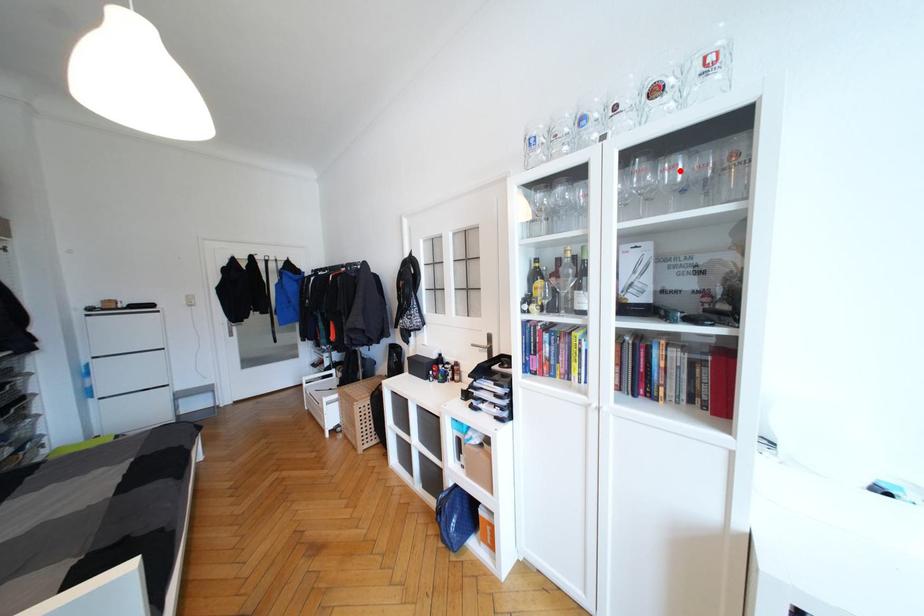
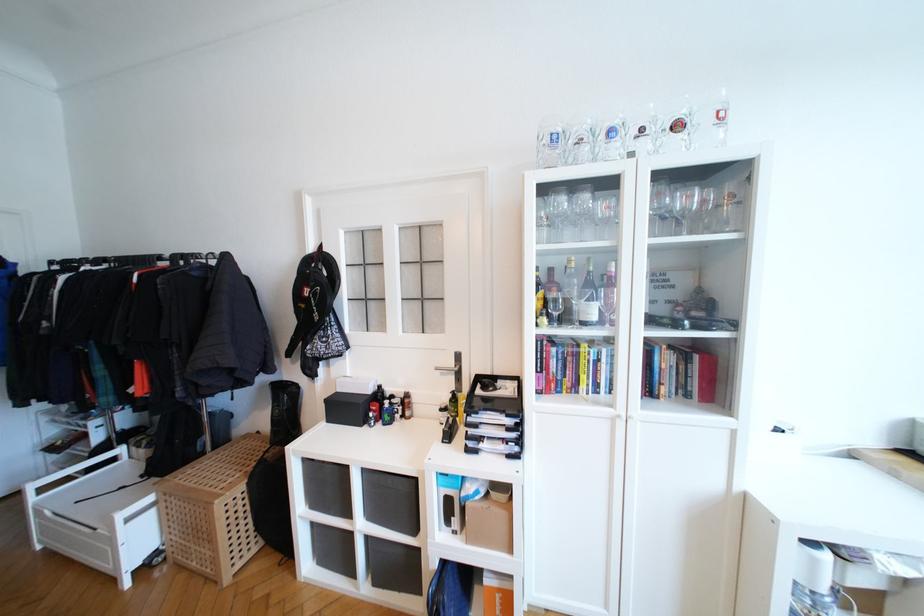
Locate, in the second image, the point that corresponds to the highlighted location in the first image.

(691, 200)